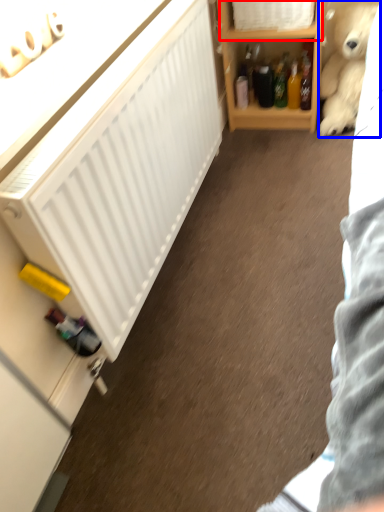
Question: Which object appears closest to the camera in this image, cabinet (highlighted by a red box) or teddy bear (highlighted by a blue box)?

Choices:
 (A) cabinet
 (B) teddy bear

Answer: (B)